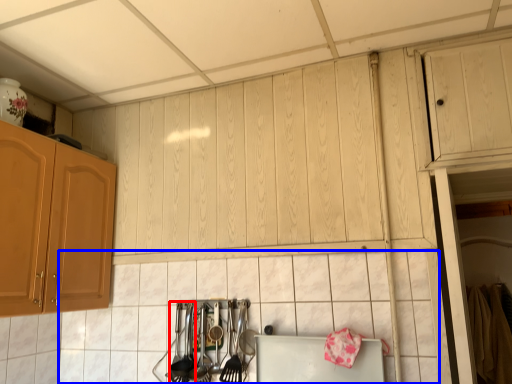
Question: Which object is further to the camera taking this photo, silverware (highlighted by a red box) or tile (highlighted by a blue box)?

Choices:
 (A) silverware
 (B) tile

Answer: (A)